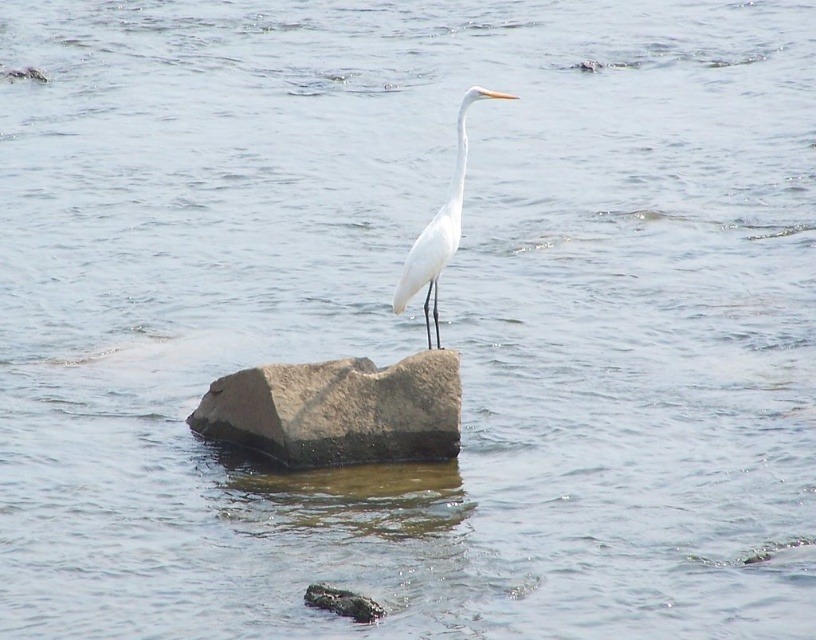
Does gray/rough stone at center have a lesser height compared to white matte bird at center?

No, gray/rough stone at center is not shorter than white matte bird at center.

This screenshot has width=816, height=640. What do you see at coordinates (338, 410) in the screenshot?
I see `gray/rough stone at center` at bounding box center [338, 410].

Where is `gray/rough stone at center`? This screenshot has height=640, width=816. gray/rough stone at center is located at coordinates (338, 410).